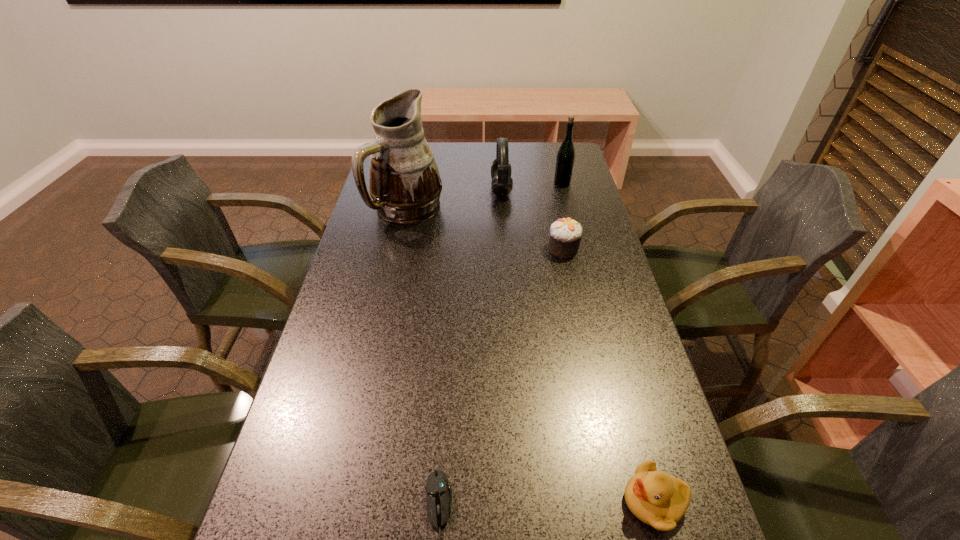
Locate an element on the screen. This screenshot has height=540, width=960. vacant region located on the earcups of the headset is located at coordinates (424, 190).

This screenshot has width=960, height=540. Find the location of `vacant area situated 0.170m on the earcups of the headset`. vacant area situated 0.170m on the earcups of the headset is located at coordinates (442, 190).

At what (x,y) coordinates should I click in order to perform the action: click on vacant space situated on the back of the cupcake. Please return your answer as a coordinate pair (x, y). Looking at the image, I should click on (556, 212).

The height and width of the screenshot is (540, 960). Find the location of `vacant space located 0.050m at the beak of the duckling`. vacant space located 0.050m at the beak of the duckling is located at coordinates (594, 501).

Find the location of a particular element. The image size is (960, 540). vacant space located 0.260m at the beak of the duckling is located at coordinates (476, 501).

At what (x,y) coordinates should I click in order to perform the action: click on free space located at the beak of the duckling. Please return your answer as a coordinate pair (x, y). This screenshot has height=540, width=960. Looking at the image, I should click on (543, 501).

This screenshot has height=540, width=960. In order to click on object present at the left edge in this screenshot , I will do `click(405, 185)`.

The width and height of the screenshot is (960, 540). What are the coordinates of `beer bottle present at the right edge` in the screenshot? It's located at (566, 154).

Identify the location of cupcake positioned at the right edge. (565, 234).

The height and width of the screenshot is (540, 960). I want to click on duckling at the right edge, so click(x=658, y=499).